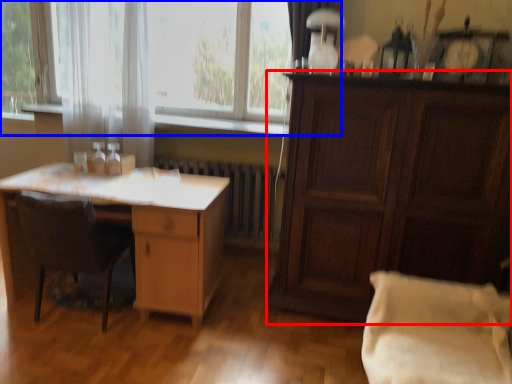
Question: Which point is closer to the camera, cabinetry (highlighted by a red box) or window (highlighted by a blue box)?

Choices:
 (A) cabinetry
 (B) window

Answer: (A)